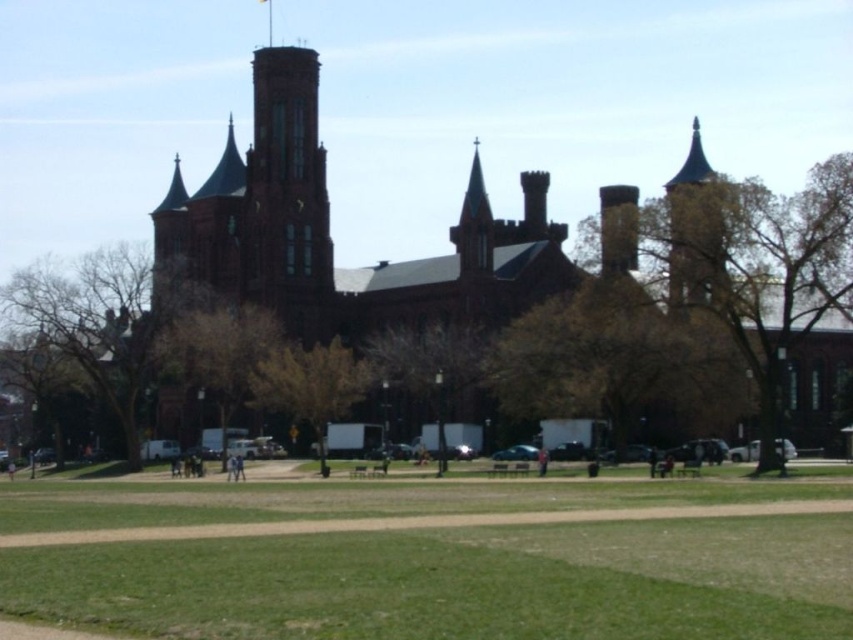
Who is positioned more to the right, green grass at lower center or brown stone tower at upper right?

brown stone tower at upper right

Does green grass at lower center appear over brown stone tower at upper right?

Incorrect, green grass at lower center is not positioned above brown stone tower at upper right.

In the scene shown: Who is more forward, (146, 474) or (693, 160)?

Point (146, 474) is more forward.

This screenshot has height=640, width=853. I want to click on green grass at lower center, so click(x=432, y=556).

This screenshot has width=853, height=640. Describe the element at coordinates (432, 556) in the screenshot. I see `green grass at lower center` at that location.

Is point (602, 636) behind point (457, 308)?

No, (602, 636) is closer to viewer.

The image size is (853, 640). In order to click on green grass at lower center in this screenshot , I will do `click(432, 556)`.

Is point (305, 64) positioned behind point (701, 172)?

That is False.

Between red brick church at center and brown stone tower at upper right, which one appears on the left side from the viewer's perspective?

red brick church at center

Who is more distant from viewer, (300, 320) or (708, 172)?

The point (300, 320) is behind.

This screenshot has height=640, width=853. I want to click on red brick church at center, so [329, 230].